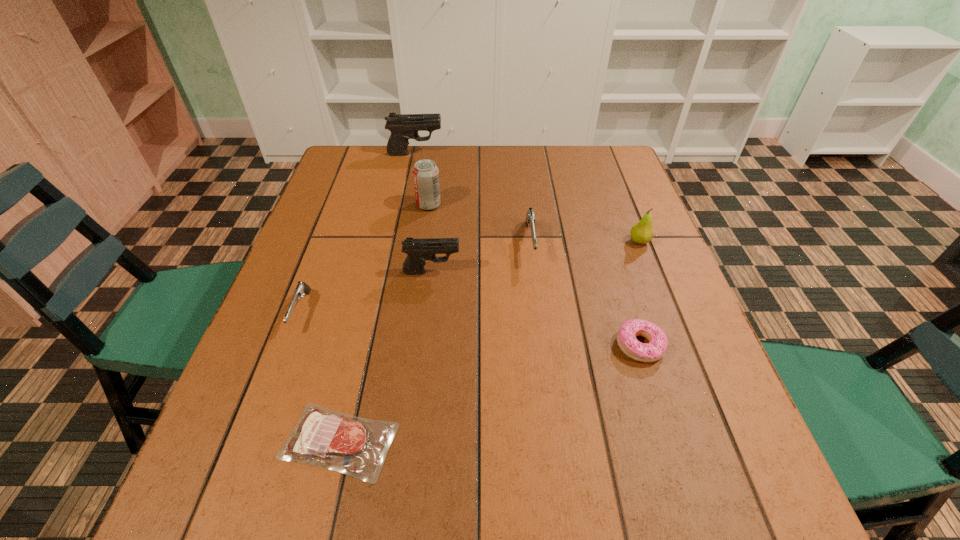
In the image, there is a desktop. Identify the location of free space at the far edge. The height and width of the screenshot is (540, 960). (391, 168).

In order to click on vacant area at the near edge in this screenshot , I will do `click(480, 529)`.

The width and height of the screenshot is (960, 540). In the image, there is a desktop. What are the coordinates of `free space at the left edge` in the screenshot? It's located at (270, 470).

The image size is (960, 540). In the image, there is a desktop. Find the location of `vacant space at the right edge`. vacant space at the right edge is located at coordinates (632, 247).

Identify the location of free space at the far right corner of the desktop. The height and width of the screenshot is (540, 960). (x=600, y=166).

In the image, there is a desktop. Find the location of `vacant space at the near right corner`. vacant space at the near right corner is located at coordinates (715, 537).

Locate an element on the screen. Image resolution: width=960 pixels, height=540 pixels. free space between the leftmost pistol and the pink doughnut is located at coordinates (470, 329).

Where is `blank region between the nearer black pistol and the nearer silver pistol`? blank region between the nearer black pistol and the nearer silver pistol is located at coordinates (367, 292).

Find the location of a particular element. The width and height of the screenshot is (960, 540). free area in between the soda can and the leftmost pistol is located at coordinates (365, 258).

At what (x,y) coordinates should I click in order to perform the action: click on vacant space in between the pink doughnut and the nearer black pistol. Please return your answer as a coordinate pair (x, y). The width and height of the screenshot is (960, 540). Looking at the image, I should click on (536, 308).